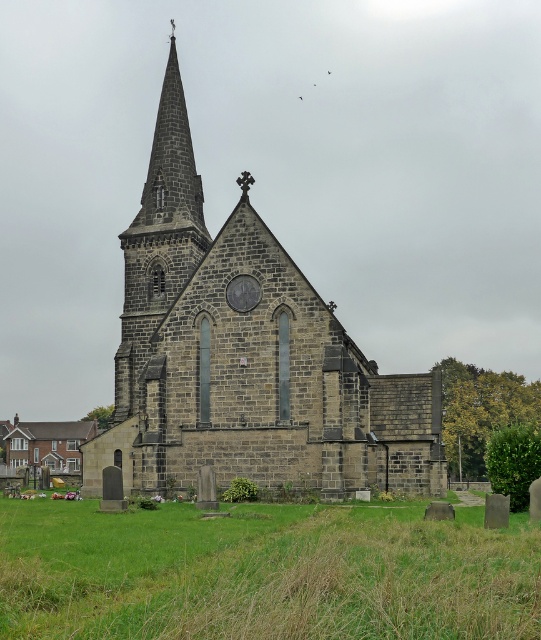
Looking at this image, you are a visitor standing at the entrance of the dark gray stone church at center. You notice the green grass at lower center nearby. Which object is bigger in size?

The dark gray stone church at center has a larger size compared to the green grass at lower center, so the church is bigger.

You are standing at the entrance of a cemetery and want to locate the dark gray stone church at center. According to the coordinates provided, where should you look relative to your position?

The dark gray stone church at center is located at point 0.558 on the x axis and 0.455 on the y axis relative to your position.